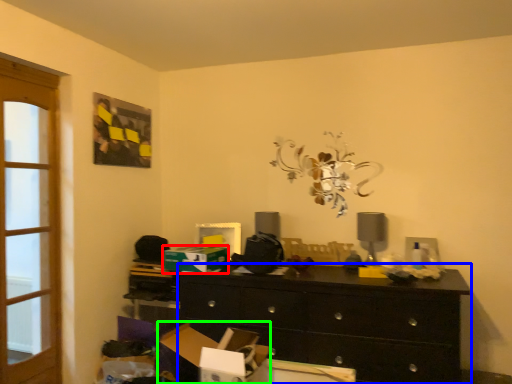
Question: Which object is the farthest from cardboard box (highlighted by a red box)? Choose among these: chest of drawers (highlighted by a blue box) or cardboard box (highlighted by a green box).

Choices:
 (A) chest of drawers
 (B) cardboard box

Answer: (A)